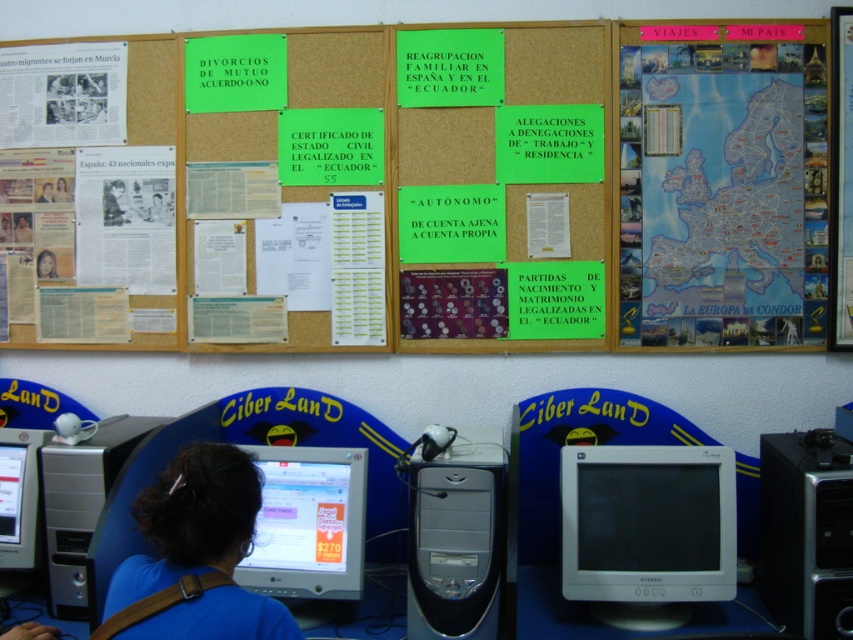
Is white glossy monitor at center positioned in front of green paper poster at upper center?

Yes, it is in front of green paper poster at upper center.

Does white glossy monitor at center have a greater width compared to green paper poster at upper center?

Correct, the width of white glossy monitor at center exceeds that of green paper poster at upper center.

This screenshot has width=853, height=640. I want to click on white glossy monitor at center, so click(647, 531).

Does blue laminated map at upper right appear on the right side of silver metallic desktop computer at lower left?

Yes, blue laminated map at upper right is to the right of silver metallic desktop computer at lower left.

Which is in front, point (697, 225) or point (48, 605)?

Positioned in front is point (48, 605).

Find the location of a particular element. blue laminated map at upper right is located at coordinates (722, 184).

Which of these two, matte black laptop at left or dark brown hair at lower center, stands taller?

matte black laptop at left is taller.

Is matte black laptop at left wider than dark brown hair at lower center?

Yes, matte black laptop at left is wider than dark brown hair at lower center.

Locate an element on the screen. The width and height of the screenshot is (853, 640). matte black laptop at left is located at coordinates (22, 227).